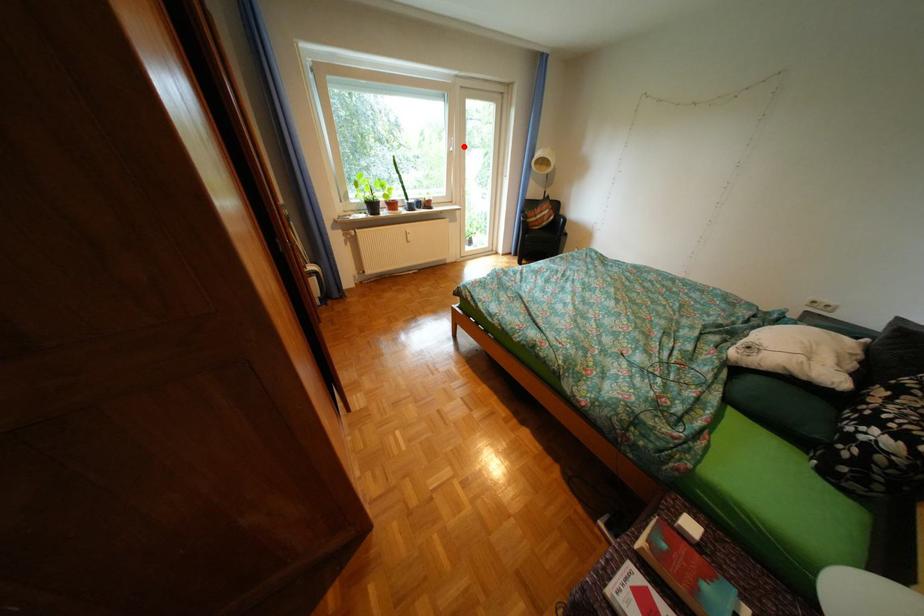
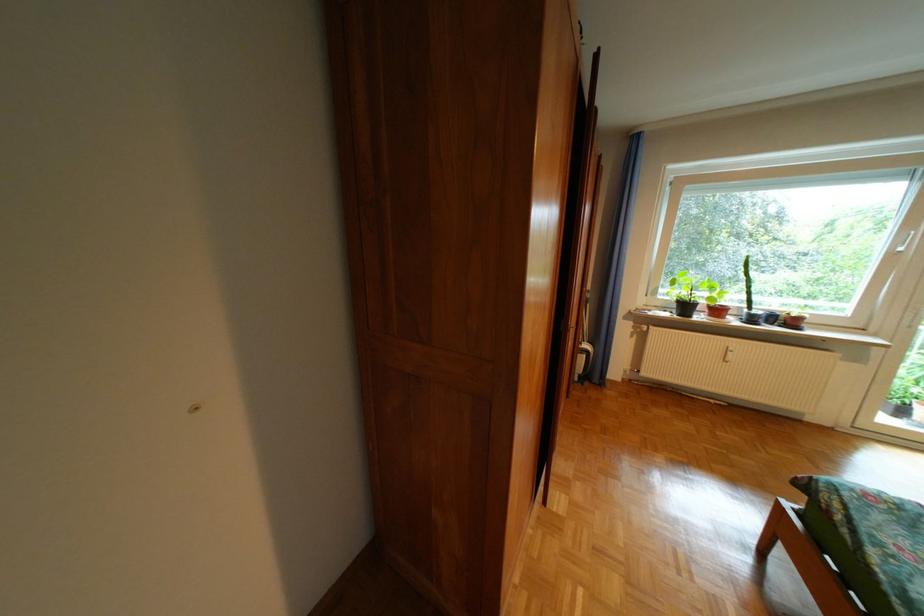
Where in the second image is the point corresponding to the highlighted location from the first image?

(912, 245)